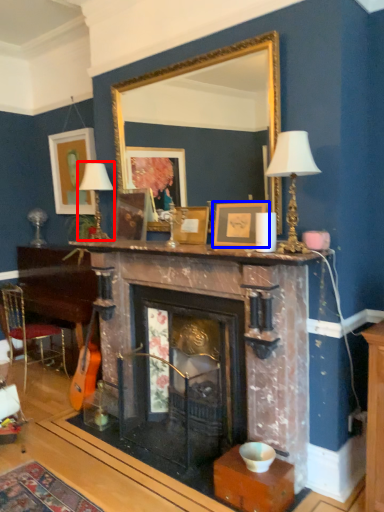
Question: Which of the following is the farthest to the observer, table lamp (highlighted by a red box) or picture frame (highlighted by a blue box)?

Choices:
 (A) table lamp
 (B) picture frame

Answer: (A)